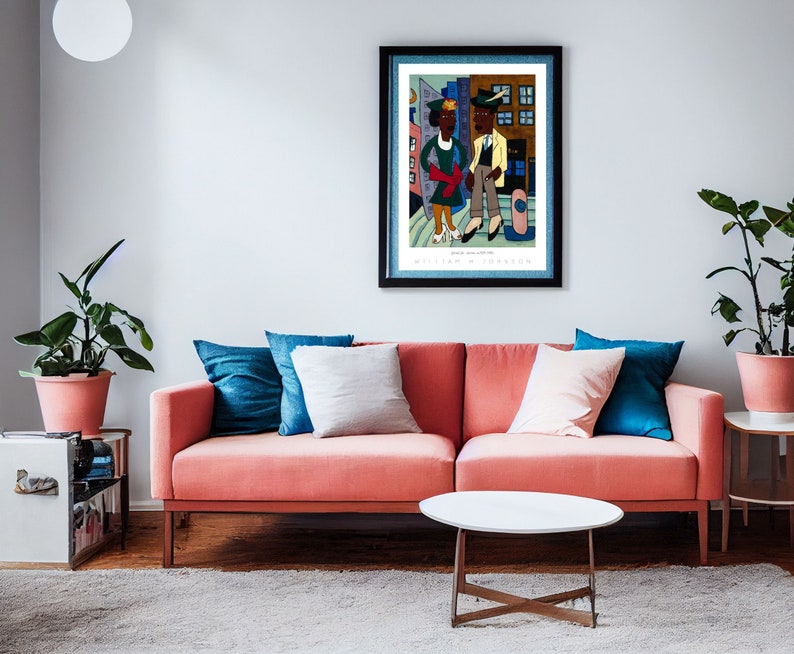
Where is `round, light red colored planters`? The height and width of the screenshot is (654, 794). round, light red colored planters is located at coordinates (764, 387), (72, 407).